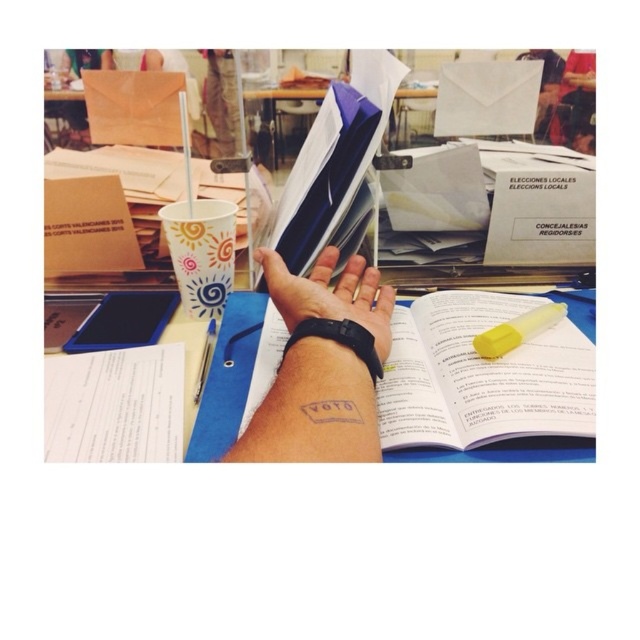
Question: Which of the following is the farthest from the observer?

Choices:
 (A) white paper book at center
 (B) yellow translucent pen at center

Answer: (B)

Question: Estimate the real-world distances between objects in this image. Which object is closer to the multicolored paper cup at center?

Choices:
 (A) light skin tone hand at center
 (B) white paper book at center
 (C) blue glossy folder at center
 (D) yellow translucent pen at center

Answer: (D)

Question: From the image, what is the correct spatial relationship of blue glossy folder at center in relation to multicolored paper cup at center?

Choices:
 (A) below
 (B) above

Answer: (B)

Question: Observing the image, what is the correct spatial positioning of white paper book at center in reference to black rubber wristband at center?

Choices:
 (A) right
 (B) left

Answer: (A)

Question: Is blue glossy folder at center wider than multicolored paper cup at center?

Choices:
 (A) no
 (B) yes

Answer: (B)

Question: Which point appears farthest from the camera in this image?

Choices:
 (A) (209, 348)
 (B) (200, 300)
 (C) (486, 451)

Answer: (B)